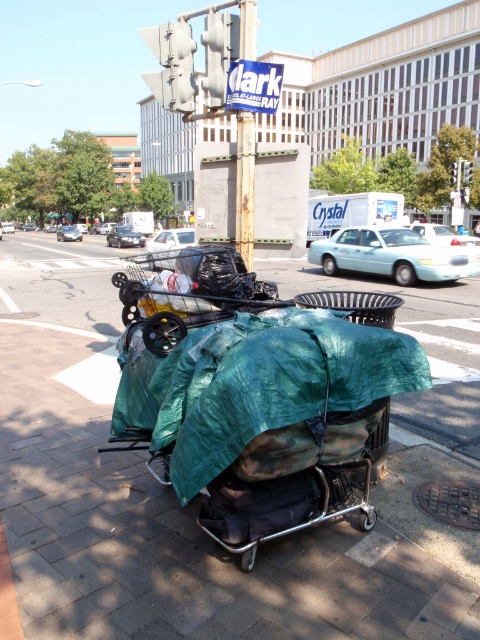
You are a delivery person trying to load a new package onto the green fabric trolley at center. The package is 1 meter tall. Can the green tarpaulin at center be placed over the package without touching the traffic light above?

The green tarpaulin at center is taller than the green fabric trolley at center, so placing it over the package might not interfere with the traffic light. However, since the tarpaulin is taller, ensure it doesn not extend upwards towards the traffic light arms. Check the vertical clearance before covering the package.

You are a delivery person with a package that needs to be placed between the green tarpaulin at center and the green fabric trolley at center. The package requires 7 feet of space. Can it fit in the available space?

The distance between the green tarpaulin at center and the green fabric trolley at center is 8.10 feet, which is more than the required 7 feet. Therefore, the package can fit in the available space.